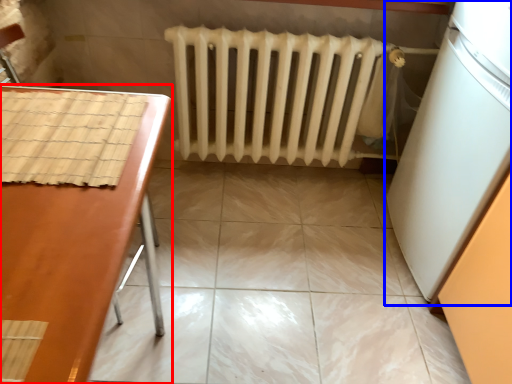
Question: Which of the following is the closest to the observer, furniture (highlighted by a red box) or appliance (highlighted by a blue box)?

Choices:
 (A) furniture
 (B) appliance

Answer: (A)